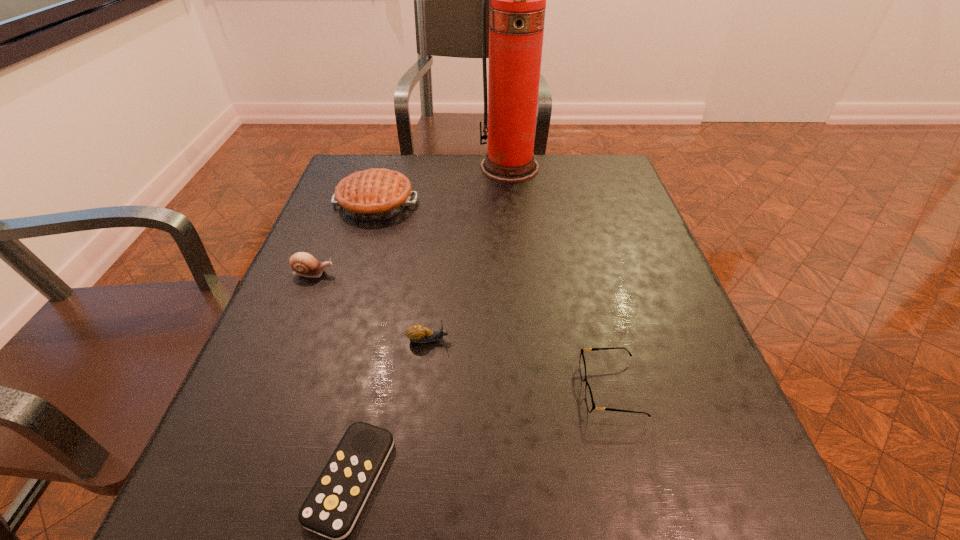
Find the location of a particular element. The image size is (960, 540). free space located at the discharge end of the farthest object is located at coordinates (518, 256).

Identify the location of blank space located 0.180m on the front of the fifth nearest object. Image resolution: width=960 pixels, height=540 pixels. (353, 275).

The image size is (960, 540). I want to click on vacant space situated on the front-facing side of the fourth shortest object, so click(x=495, y=273).

I want to click on blank space located on the front-facing side of the right escargot, so tap(671, 340).

Locate an element on the screen. The height and width of the screenshot is (540, 960). vacant space situated 0.290m on the front-facing side of the second shortest object is located at coordinates (407, 389).

Locate an element on the screen. This screenshot has width=960, height=540. vacant region located on the front-facing side of the second shortest object is located at coordinates click(492, 389).

Find the location of a particular element. This screenshot has width=960, height=540. vacant space located on the front-facing side of the second shortest object is located at coordinates (492, 389).

Where is `fire extinguisher that is at the far edge`? This screenshot has width=960, height=540. fire extinguisher that is at the far edge is located at coordinates (x=517, y=7).

The width and height of the screenshot is (960, 540). I want to click on pie positioned at the far edge, so click(376, 194).

Locate an element on the screen. The image size is (960, 540). pie positioned at the left edge is located at coordinates (376, 194).